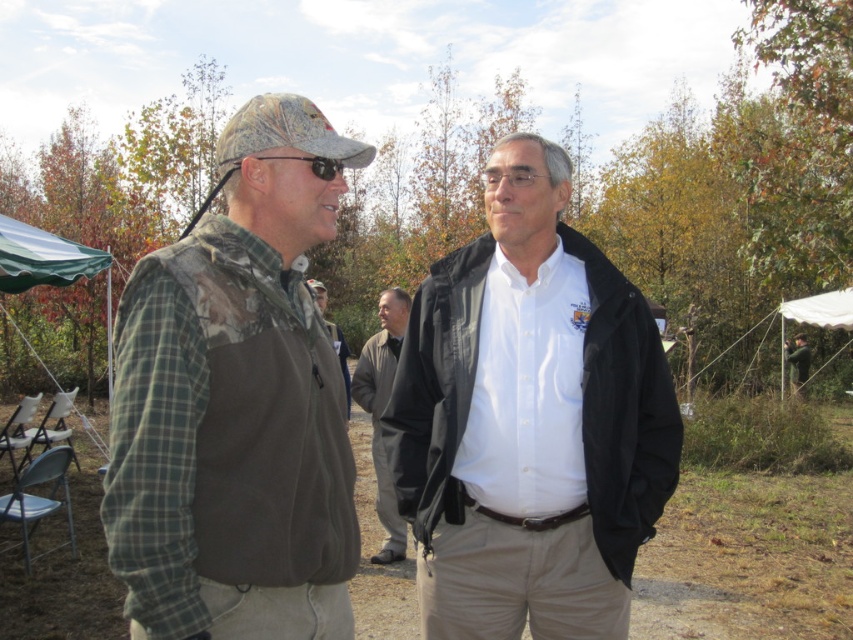
You are planning to take a photo of the dark gray jacket at center and the green fabric canopy at upper left. Which object should you focus on first to ensure both are in frame without moving the camera?

You should focus on the dark gray jacket at center first because the green fabric canopy at upper left is behind it, so keeping the jacket centered will allow the canopy to remain in the background of the frame.

You are a photographer at the event and want to ensure both jackets are visible in the photo. Since the camouflage jacket at center and the green fabric jacket at center are overlapping, which jacket should you adjust to avoid covering the other?

The camouflage jacket at center is positioned over green fabric jacket at center, so you should adjust the camouflage jacket at center to move it away from the green fabric jacket at center to ensure both are visible.

You are a photographer holding a camera and need to hand it to the man wearing the camouflage fabric vest at center. Can you reach him without moving your feet?

A: The camouflage fabric vest at center and camera are 1.44 meters apart. Since the average human arm span is about 1.5 meters, you can likely reach him by stretching your arm out fully.